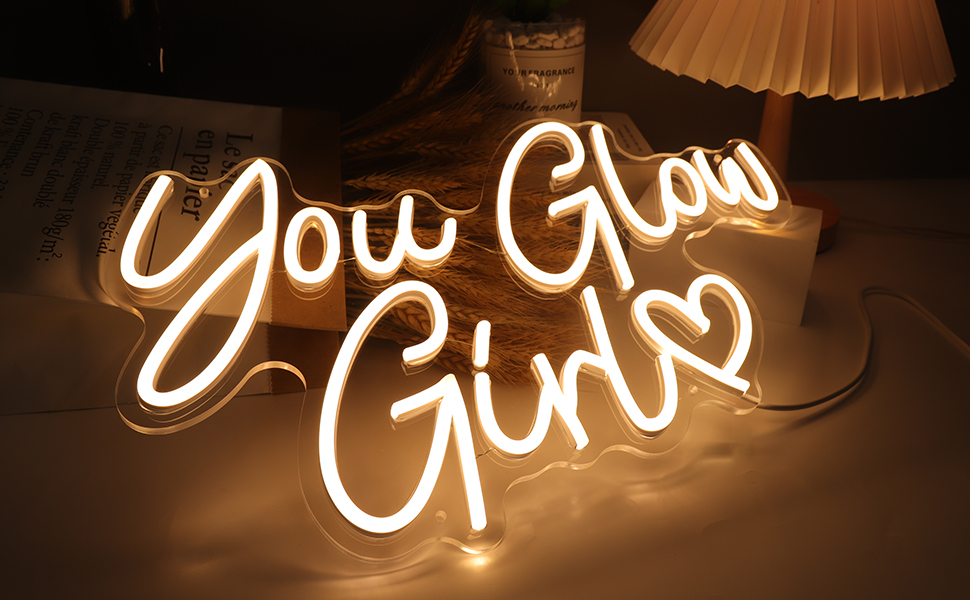
Identify the location of desk light. This screenshot has width=970, height=600. (767, 37).